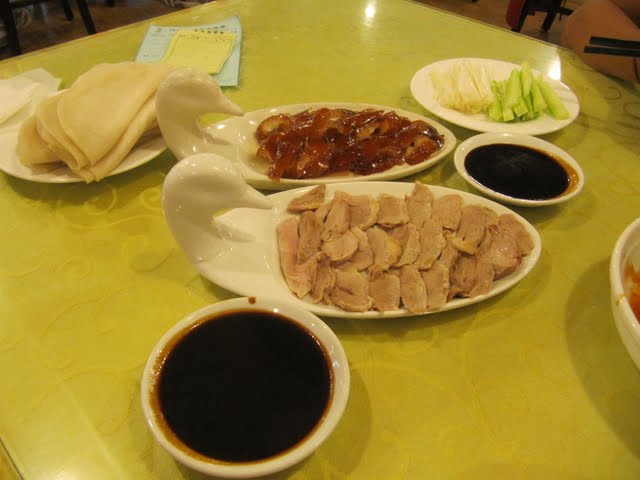
Identify the location of yellow table surface. The image size is (640, 480). (500, 350), (80, 272).